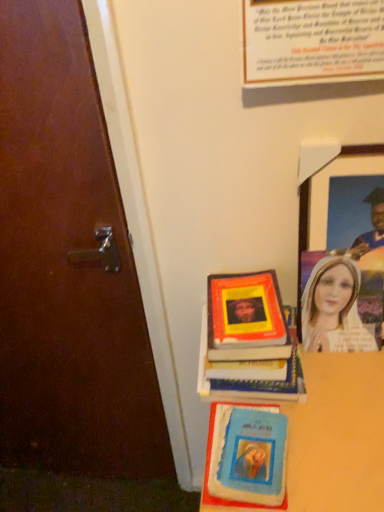
Where is `vacant region above hardcover book at center (from a real-world perspective)`? This screenshot has width=384, height=512. vacant region above hardcover book at center (from a real-world perspective) is located at coordinates (243, 306).